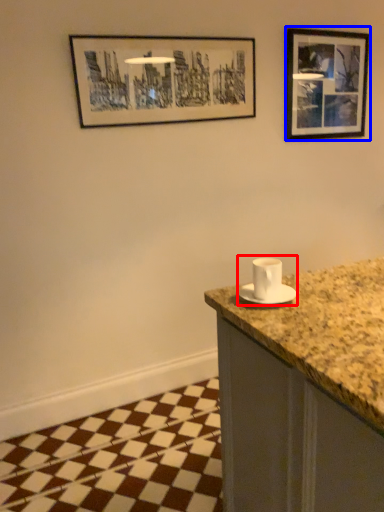
Question: Which object appears closest to the camera in this image, sink (highlighted by a red box) or picture frame (highlighted by a blue box)?

Choices:
 (A) sink
 (B) picture frame

Answer: (A)